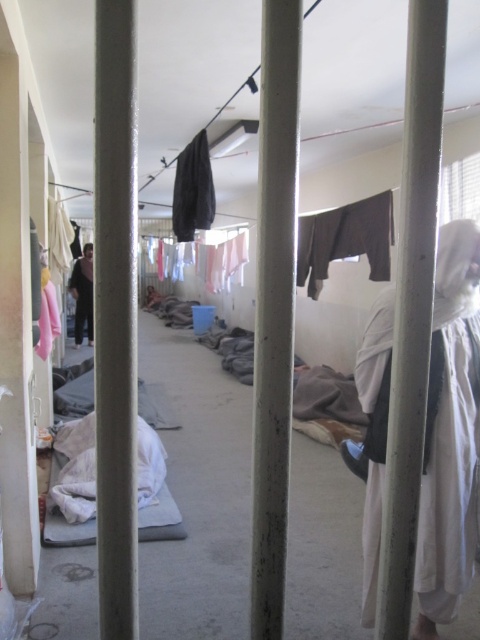
Is metallic gray pole at center thinner than dark gray fabric robe at center?

Indeed, metallic gray pole at center has a lesser width compared to dark gray fabric robe at center.

Which is more to the left, metallic gray pole at center or dark gray fabric robe at center?

Positioned to the left is dark gray fabric robe at center.

Image resolution: width=480 pixels, height=640 pixels. Find the location of `metallic gray pole at center`. metallic gray pole at center is located at coordinates (411, 310).

Which is above, white matte pole at center or dark gray fabric at center?

dark gray fabric at center

Is white matte pole at center bigger than dark gray fabric at center?

No, white matte pole at center is not bigger than dark gray fabric at center.

Which is behind, point (284, 432) or point (212, 212)?

Positioned behind is point (212, 212).

Where is `white matte pole at center`? The height and width of the screenshot is (640, 480). white matte pole at center is located at coordinates (274, 308).

Between point (260, 397) and point (408, 483), which one is positioned in front?

Point (260, 397) is more forward.

Consider the image. Can you confirm if white matte pole at center is bigger than metallic gray pole at center?

No.

Is point (288, 122) in front of point (408, 400)?

Yes, it is.

This screenshot has width=480, height=640. I want to click on white matte pole at center, so click(x=274, y=308).